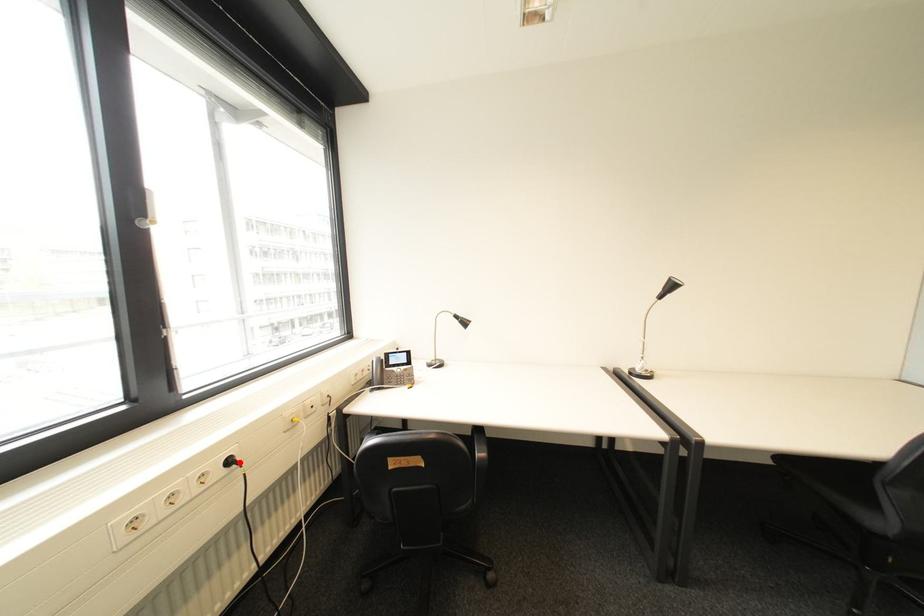
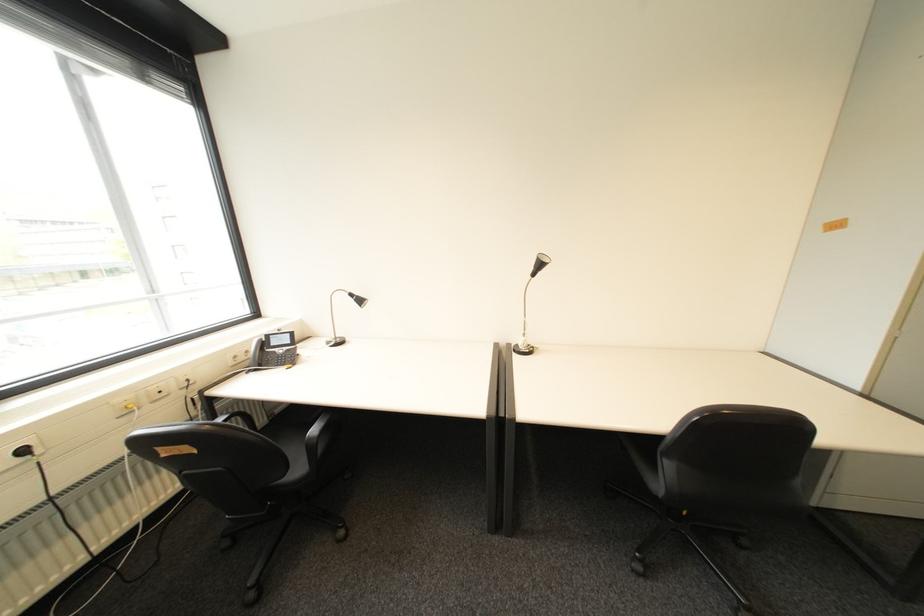
Find the pixel in the second image that matches the highlighted location in the first image.

(34, 452)